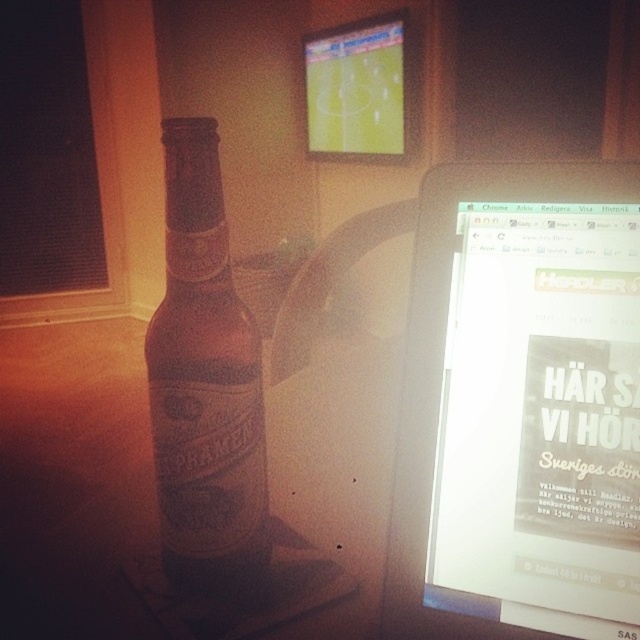
Looking at this image, you are setting up a home office and want to ensure that both the white glossy computer monitor at upper right and the matte plastic screen at upper center are visible from your desk. Based on their positions, which one would you need to adjust to avoid obstruction?

The white glossy computer monitor at upper right is in front of the matte plastic screen at upper center. To avoid obstruction, you should adjust the white glossy computer monitor at upper right so it doesn not block the matte plastic screen at upper center.

You are organizing a desk and need to move the white glossy computer monitor at upper right and the brown glass bottle at left. Which object should you move first if you want to access the other without moving it?

You should move the white glossy computer monitor at upper right first because it is in front of the brown glass bottle at left, so moving it will allow you to access the brown glass bottle at left without moving the monitor afterward.

You are setting up a desk in this scene and need to place a new keyboard between the white glossy computer monitor at upper right and the matte plastic screen at upper center. Based on their positions, can the keyboard fit horizontally between them?

The white glossy computer monitor at upper right is positioned under the matte plastic screen at upper center, meaning they are stacked vertically rather than side by side. Therefore, there is no horizontal space between them for the keyboard to fit.